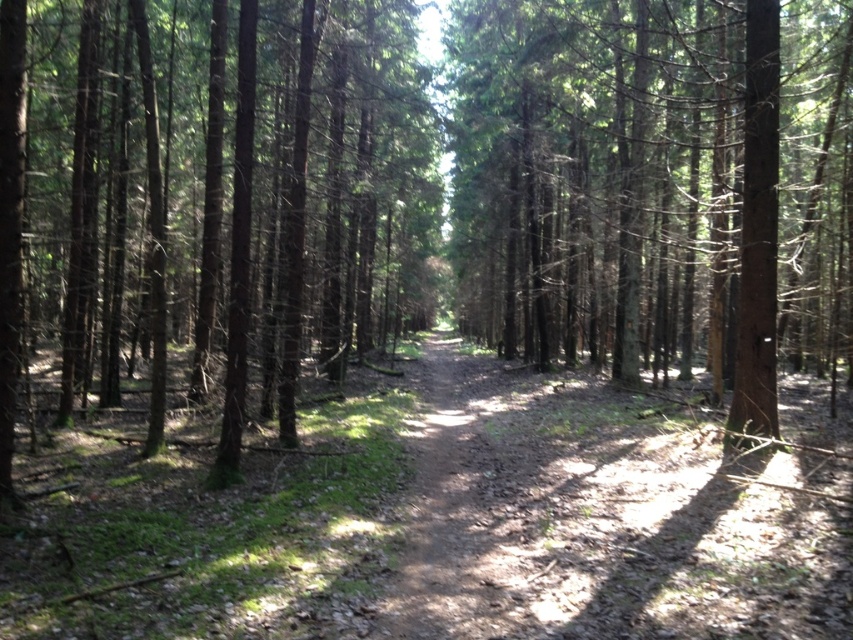
Can you confirm if brown/dry wood at center is positioned to the right of brown dirt track at center?

Yes, brown/dry wood at center is to the right of brown dirt track at center.

Identify the location of brown/dry wood at center. The height and width of the screenshot is (640, 853). (648, 170).

I want to click on brown/dry wood at center, so click(648, 170).

Can you confirm if brown/dry wood at center is positioned to the right of brown wood tree at center?

Yes, brown/dry wood at center is to the right of brown wood tree at center.

Looking at this image, who is more forward, (467, 237) or (160, 426)?

Point (160, 426) is more forward.

The image size is (853, 640). Find the location of `brown/dry wood at center`. brown/dry wood at center is located at coordinates (648, 170).

Who is more forward, [444,513] or [242,99]?

Point [444,513]

Is brown dirt track at center to the right of brown wood tree at center from the viewer's perspective?

Correct, you'll find brown dirt track at center to the right of brown wood tree at center.

The image size is (853, 640). What do you see at coordinates (607, 516) in the screenshot?
I see `brown dirt track at center` at bounding box center [607, 516].

In order to click on brown dirt track at center in this screenshot , I will do `click(607, 516)`.